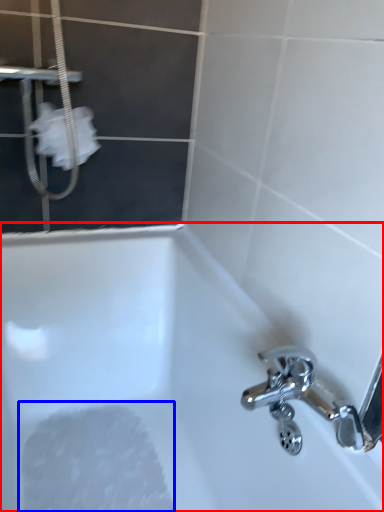
Question: Among these objects, which one is nearest to the camera, bathtub (highlighted by a red box) or foam (highlighted by a blue box)?

Choices:
 (A) bathtub
 (B) foam

Answer: (A)